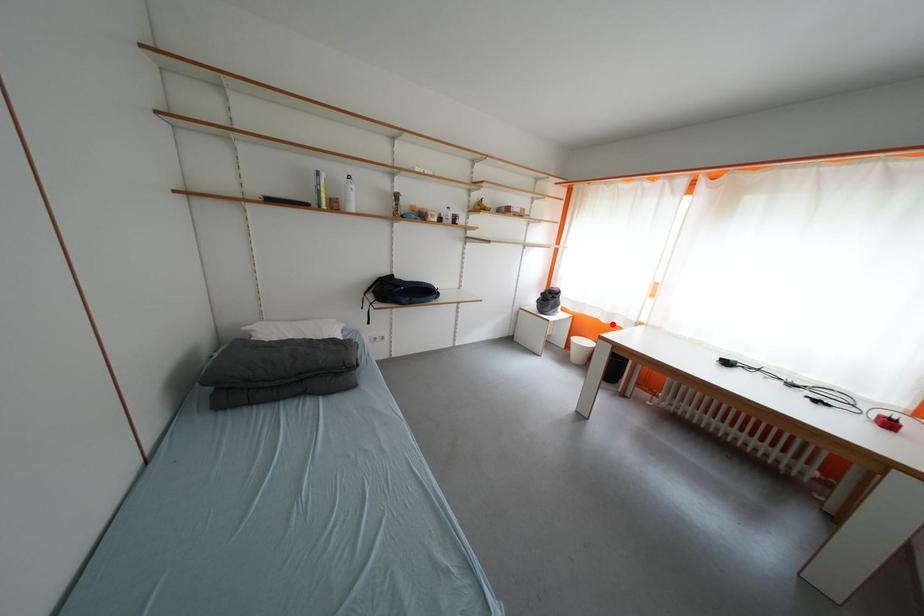
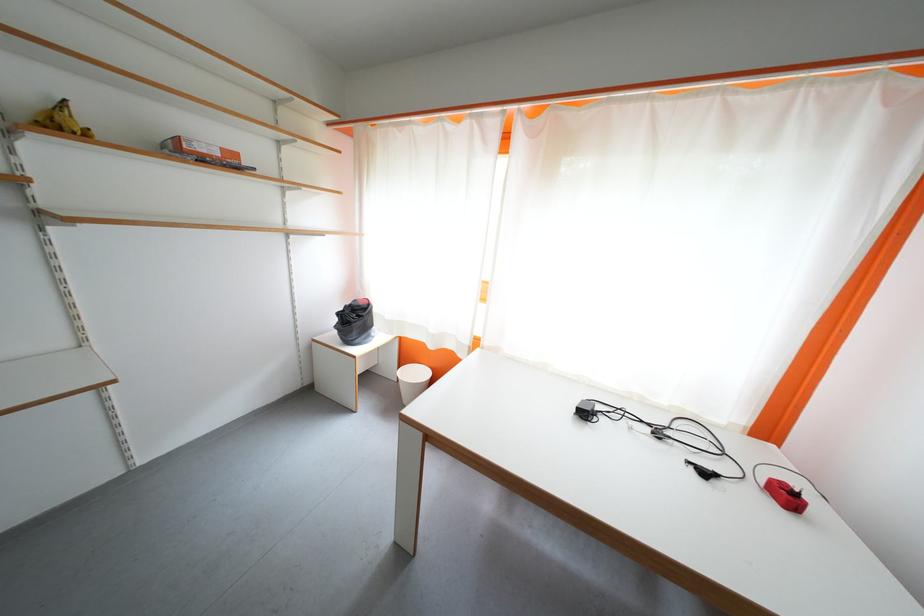
Question: I am providing you with two images of the same scene from different viewpoints. A red point is shown in image1. For the corresponding object point in image2, is it positioned nearer or farther from the camera?

Choices:
 (A) Nearer
 (B) Farther

Answer: (B)